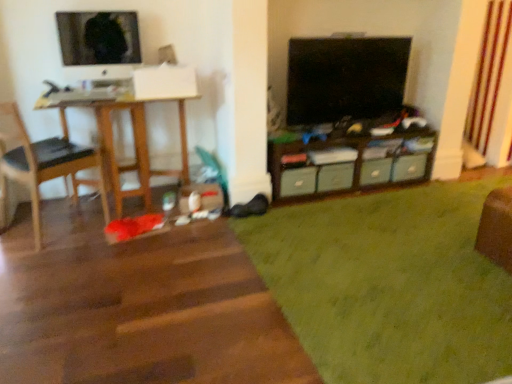
What is the approximate width of black leather chair at left?

black leather chair at left is 19.57 inches wide.

The width and height of the screenshot is (512, 384). In order to click on wooden cabinet at center in this screenshot , I will do `click(348, 163)`.

In order to face matte plastic drawer at center, marked as the 4th drawer in a left-to-right arrangement, should I rotate leftwards or rightwards?

A 19.408 degree turn to the right will do.

Identify the location of matte plastic drawer at center, marked as the 4th drawer in a left-to-right arrangement. (409, 167).

You are a GUI agent. You are given a task and a screenshot of the screen. Output one action in this format:
    pyautogui.click(x=<x>, y=<y>)
    Task: Click on the black glossy tv at upper center, which is counted as the first television, starting from the right
    
    Given the screenshot: What is the action you would take?
    pyautogui.click(x=345, y=78)

What do you see at coordinates (375, 171) in the screenshot? I see `green matte drawer at center, placed as the 3th drawer when sorted from left to right` at bounding box center [375, 171].

Identify the location of matte black monitor at upper left, which is the 2th television from right to left. The height and width of the screenshot is (384, 512). (98, 38).

From the image's perspective, between wooden desk at left and black glossy tv at upper center, which is counted as the first television, starting from the right, who is located below?

From the image's view, wooden desk at left is below.

Is wooden desk at left wider or thinner than black glossy tv at upper center, which is counted as the second television, starting from the left?

Clearly, wooden desk at left has more width compared to black glossy tv at upper center, which is counted as the second television, starting from the left.

I want to click on television that is the 2nd one when counting backward from the wooden desk at left, so click(345, 78).

In the image, is wooden desk at left positioned in front of or behind black glossy tv at upper center, which is counted as the first television, starting from the right?

Clearly, wooden desk at left is in front of black glossy tv at upper center, which is counted as the first television, starting from the right.

From a real-world perspective, is matte black monitor at upper left, the 1th television positioned from the left, located higher than green shag rug at lower right?

Yes, from a real-world perspective, matte black monitor at upper left, the 1th television positioned from the left, is on top of green shag rug at lower right.

Considering the points (127, 29) and (330, 282), which point is behind, point (127, 29) or point (330, 282)?

The point (127, 29) is behind.

Is matte black monitor at upper left, which is the 2th television from right to left, located outside green shag rug at lower right?

Yes, matte black monitor at upper left, which is the 2th television from right to left, is outside of green shag rug at lower right.

Is matte black monitor at upper left, which is the 2th television from right to left, looking in the opposite direction of green shag rug at lower right?

matte black monitor at upper left, which is the 2th television from right to left, is not turned away from green shag rug at lower right.

Is green matte drawer at center, positioned as the 2th drawer in right-to-left order, looking in the opposite direction of black leather chair at left?

No, green matte drawer at center, positioned as the 2th drawer in right-to-left order, is not facing away from black leather chair at left.

Can we say green matte drawer at center, placed as the 3th drawer when sorted from left to right, lies outside black leather chair at left?

Yes, green matte drawer at center, placed as the 3th drawer when sorted from left to right, is outside of black leather chair at left.

Which point is more forward, [362,173] or [31,179]?

The point [31,179] is closer to the camera.

From the image's perspective, between green matte drawer at center, positioned as the 2th drawer in right-to-left order, and black leather chair at left, which one is located above?

black leather chair at left, from the image's perspective.

Could you tell me if black glossy tv at upper center, which is counted as the second television, starting from the left, is facing matte plastic drawer at center, marked as the 4th drawer in a left-to-right arrangement?

No, black glossy tv at upper center, which is counted as the second television, starting from the left, is not aimed at matte plastic drawer at center, marked as the 4th drawer in a left-to-right arrangement.

From the image's perspective, is black glossy tv at upper center, which is counted as the second television, starting from the left, below matte plastic drawer at center, marked as the 4th drawer in a left-to-right arrangement?

No, from the image's perspective, black glossy tv at upper center, which is counted as the second television, starting from the left, is not beneath matte plastic drawer at center, marked as the 4th drawer in a left-to-right arrangement.

From the picture: Which is correct: black glossy tv at upper center, which is counted as the second television, starting from the left, is inside matte plastic drawer at center, marked as the 4th drawer in a left-to-right arrangement, or outside of it?

black glossy tv at upper center, which is counted as the second television, starting from the left, is spatially situated outside matte plastic drawer at center, marked as the 4th drawer in a left-to-right arrangement.

Considering the positions of points (303, 80) and (414, 165), is point (303, 80) farther from camera compared to point (414, 165)?

No.

From the image's perspective, is green fabric drawer at center, the 3th drawer from the right, located above matte plastic drawer at center, which is the 1th drawer in right-to-left order?

No, from the image's perspective, green fabric drawer at center, the 3th drawer from the right, is not above matte plastic drawer at center, which is the 1th drawer in right-to-left order.

Can you confirm if green fabric drawer at center, the second drawer when ordered from left to right, is taller than matte plastic drawer at center, which is the 1th drawer in right-to-left order?

Correct, green fabric drawer at center, the second drawer when ordered from left to right, is much taller as matte plastic drawer at center, which is the 1th drawer in right-to-left order.

Does green fabric drawer at center, the 3th drawer from the right, have a greater width compared to matte plastic drawer at center, which is the 1th drawer in right-to-left order?

Yes.

Are green fabric drawer at center, the second drawer when ordered from left to right, and matte plastic drawer at center, marked as the 4th drawer in a left-to-right arrangement, making contact?

No, green fabric drawer at center, the second drawer when ordered from left to right, is not touching matte plastic drawer at center, marked as the 4th drawer in a left-to-right arrangement.

Which is behind, point (4, 120) or point (319, 166)?

The point (319, 166) is farther.

From a real-world perspective, is black leather chair at left beneath green fabric drawer at center, the second drawer when ordered from left to right?

No, from a real-world perspective, black leather chair at left is not below green fabric drawer at center, the second drawer when ordered from left to right.

From the image's perspective, which drawer is the 2nd one below the black leather chair at left? Please provide its 2D coordinates.

[(335, 177)]

Who is bigger, black leather chair at left or green fabric drawer at center, the 3th drawer from the right?

With larger size is black leather chair at left.

Is matte black monitor at upper left, which is the 2th television from right to left, positioned with its back to green matte drawer at center, which is the 4th drawer in right-to-left order?

No, matte black monitor at upper left, which is the 2th television from right to left,'s orientation is not away from green matte drawer at center, which is the 4th drawer in right-to-left order.

Which object is more forward, matte black monitor at upper left, the 1th television positioned from the left, or green matte drawer at center, which is the first drawer in left-to-right order?

matte black monitor at upper left, the 1th television positioned from the left.

From the image's perspective, is matte black monitor at upper left, which is the 2th television from right to left, located beneath green matte drawer at center, which is the first drawer in left-to-right order?

No, from the image's perspective, matte black monitor at upper left, which is the 2th television from right to left, is not beneath green matte drawer at center, which is the first drawer in left-to-right order.

Which object is thinner, matte black monitor at upper left, which is the 2th television from right to left, or green matte drawer at center, which is the 4th drawer in right-to-left order?

matte black monitor at upper left, which is the 2th television from right to left, is thinner.

At what (x,y) coordinates should I click in order to perform the action: click on desk that is on the left side of black glossy tv at upper center, which is counted as the second television, starting from the left. Please return your answer as a coordinate pair (x, y). Looking at the image, I should click on (134, 144).

This screenshot has height=384, width=512. I want to click on plain below the matte black monitor at upper left, which is the 2th television from right to left (from a real-world perspective), so click(x=389, y=283).

From the image, which object appears to be farther from green matte drawer at center, positioned as the 2th drawer in right-to-left order, green shag rug at lower right or matte plastic drawer at center, marked as the 4th drawer in a left-to-right arrangement?

green shag rug at lower right is further to green matte drawer at center, positioned as the 2th drawer in right-to-left order.

Looking at this image, considering their positions, is wooden cabinet at center positioned further to green matte drawer at center, placed as the 3th drawer when sorted from left to right, than green shag rug at lower right?

green shag rug at lower right is positioned further to the anchor green matte drawer at center, placed as the 3th drawer when sorted from left to right.

Based on their spatial positions, is black glossy tv at upper center, which is counted as the first television, starting from the right, or black leather chair at left closer to green fabric drawer at center, the 3th drawer from the right?

The object closer to green fabric drawer at center, the 3th drawer from the right, is black glossy tv at upper center, which is counted as the first television, starting from the right.

Looking at the image, which one is located further to green fabric drawer at center, the 3th drawer from the right, green shag rug at lower right or matte plastic drawer at center, marked as the 4th drawer in a left-to-right arrangement?

green shag rug at lower right is positioned further to the anchor green fabric drawer at center, the 3th drawer from the right.

Which object lies further to the anchor point matte black monitor at upper left, which is the 2th television from right to left, green fabric drawer at center, the 3th drawer from the right, or matte plastic drawer at center, marked as the 4th drawer in a left-to-right arrangement?

matte plastic drawer at center, marked as the 4th drawer in a left-to-right arrangement.

When comparing their distances from black leather chair at left, does matte plastic drawer at center, which is the 1th drawer in right-to-left order, or green matte drawer at center, which is the first drawer in left-to-right order, seem closer?

Among the two, green matte drawer at center, which is the first drawer in left-to-right order, is located nearer to black leather chair at left.

Estimate the real-world distances between objects in this image. Which object is further from green matte drawer at center, which is the 4th drawer in right-to-left order, wooden desk at left or matte black monitor at upper left, the 1th television positioned from the left?

matte black monitor at upper left, the 1th television positioned from the left, lies further to green matte drawer at center, which is the 4th drawer in right-to-left order, than the other object.

Considering their positions, is matte plastic drawer at center, marked as the 4th drawer in a left-to-right arrangement, positioned closer to green fabric drawer at center, the 3th drawer from the right, than wooden desk at left?

matte plastic drawer at center, marked as the 4th drawer in a left-to-right arrangement, is positioned closer to the anchor green fabric drawer at center, the 3th drawer from the right.

I want to click on drawer between matte black monitor at upper left, the 1th television positioned from the left, and green fabric drawer at center, the second drawer when ordered from left to right, so click(298, 181).

You are a GUI agent. You are given a task and a screenshot of the screen. Output one action in this format:
    pyautogui.click(x=<x>, y=<y>)
    Task: Click on the television between matte black monitor at upper left, which is the 2th television from right to left, and wooden cabinet at center
    
    Given the screenshot: What is the action you would take?
    pyautogui.click(x=345, y=78)

Locate an element on the screen. shelf between green shag rug at lower right and matte plastic drawer at center, which is the 1th drawer in right-to-left order, from front to back is located at coordinates (348, 163).

Locate an element on the screen. The image size is (512, 384). shelf between matte black monitor at upper left, which is the 2th television from right to left, and green matte drawer at center, placed as the 3th drawer when sorted from left to right, in the horizontal direction is located at coordinates (348, 163).